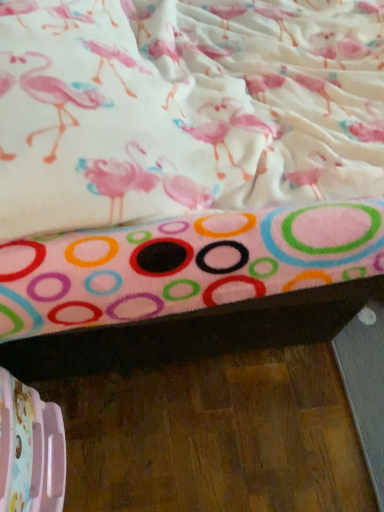
What do you see at coordinates (180, 189) in the screenshot? I see `soft pink fabric at center` at bounding box center [180, 189].

I want to click on soft pink fabric at center, so click(180, 189).

The height and width of the screenshot is (512, 384). Find the location of `soft pink fabric at center`. soft pink fabric at center is located at coordinates (180, 189).